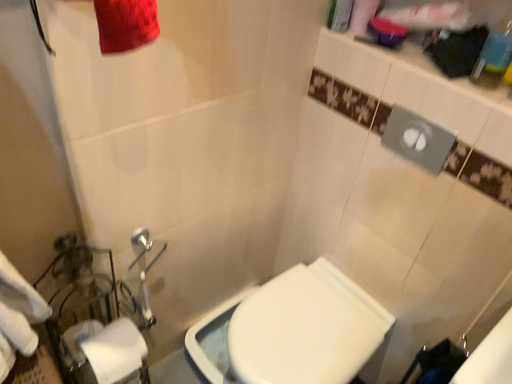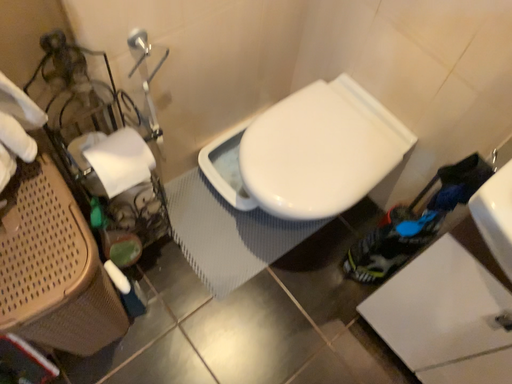
Question: How did the camera likely rotate when shooting the video?

Choices:
 (A) rotated downward
 (B) rotated upward

Answer: (A)